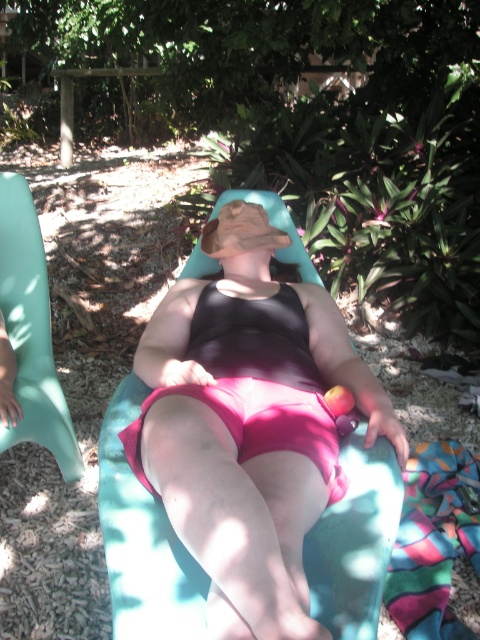
Question: Which object appears farthest from the camera in this image?

Choices:
 (A) pink matte swimsuit at center
 (B) teal plastic beach chair at left

Answer: (B)

Question: In this image, where is pink matte swimsuit at center located relative to teal plastic beach chair at left?

Choices:
 (A) left
 (B) right

Answer: (B)

Question: Which point is closer to the camera taking this photo?

Choices:
 (A) (7, 308)
 (B) (199, 548)

Answer: (B)

Question: Is pink matte swimsuit at center bigger than teal plastic beach chair at left?

Choices:
 (A) yes
 (B) no

Answer: (A)

Question: Can you confirm if pink matte swimsuit at center is bigger than teal plastic beach chair at left?

Choices:
 (A) no
 (B) yes

Answer: (B)